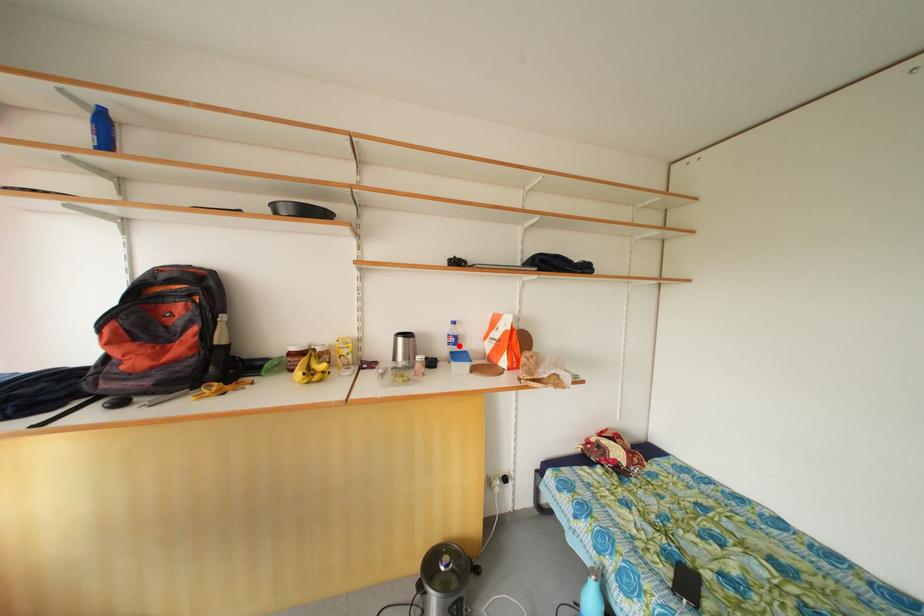
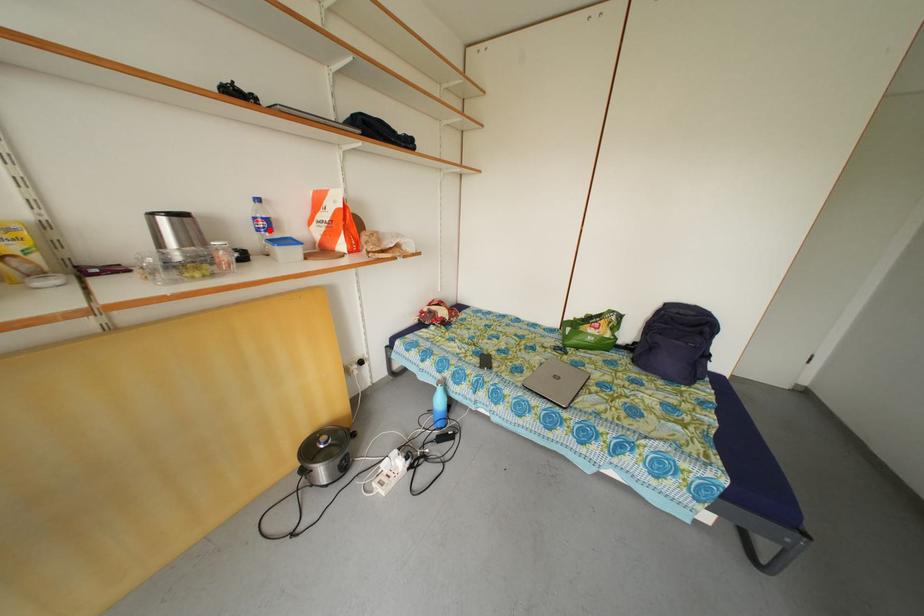
I am providing you with two images of the same scene from different viewpoints. A red point is marked on the first image and another point is marked on the second image. Is the red point in image1 aligned with the point shown in image2?

Yes